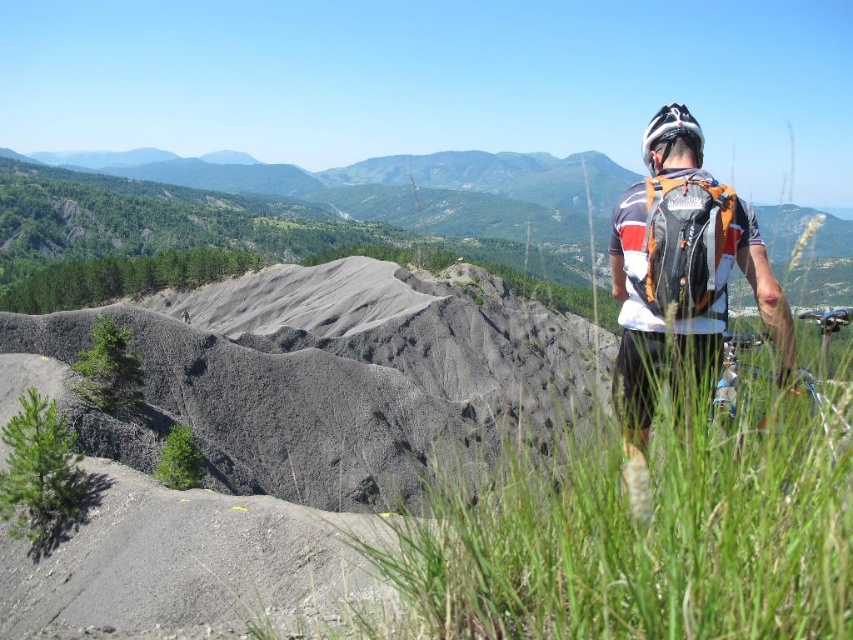
Which is more to the left, green grass at lower right or shiny metallic bicycle at right?

Positioned to the left is green grass at lower right.

Can you confirm if green grass at lower right is positioned below shiny metallic bicycle at right?

Yes, green grass at lower right is below shiny metallic bicycle at right.

Is point (642, 616) closer to camera compared to point (849, 316)?

Yes, it is in front of point (849, 316).

Where is `green grass at lower right`? green grass at lower right is located at coordinates (637, 541).

Does green grass at lower right have a smaller size compared to white matte bicycle helmet at upper right?

Indeed, green grass at lower right has a smaller size compared to white matte bicycle helmet at upper right.

Is green grass at lower right taller than white matte bicycle helmet at upper right?

In fact, green grass at lower right may be shorter than white matte bicycle helmet at upper right.

The width and height of the screenshot is (853, 640). What do you see at coordinates (637, 541) in the screenshot?
I see `green grass at lower right` at bounding box center [637, 541].

At what (x,y) coordinates should I click in order to perform the action: click on green grass at lower right. Please return your answer as a coordinate pair (x, y). The width and height of the screenshot is (853, 640). Looking at the image, I should click on (637, 541).

This screenshot has height=640, width=853. What do you see at coordinates (730, 376) in the screenshot? I see `shiny metallic bicycle at right` at bounding box center [730, 376].

Does shiny metallic bicycle at right appear on the right side of white matte bicycle helmet at upper right?

Indeed, shiny metallic bicycle at right is positioned on the right side of white matte bicycle helmet at upper right.

Where is `shiny metallic bicycle at right`? shiny metallic bicycle at right is located at coordinates (730, 376).

In order to click on shiny metallic bicycle at right in this screenshot , I will do `click(730, 376)`.